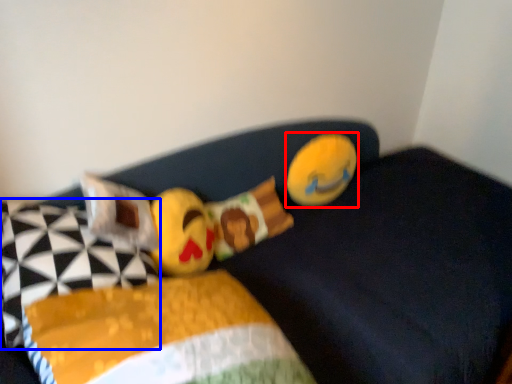
Question: Which object is further to the camera taking this photo, toy (highlighted by a red box) or pillow (highlighted by a blue box)?

Choices:
 (A) toy
 (B) pillow

Answer: (A)